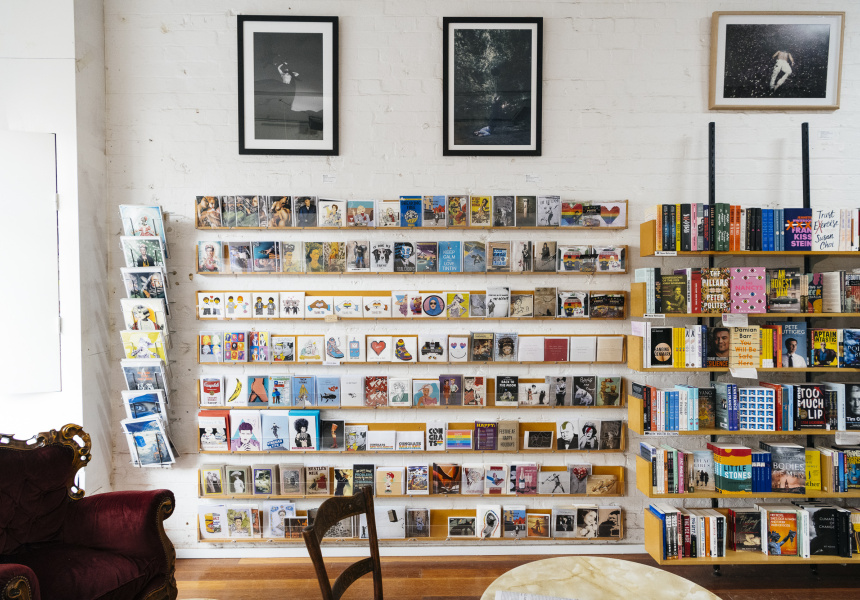
What are the coordinates of `paintings` in the screenshot? It's located at (277, 100), (495, 97), (754, 73), (488, 49).